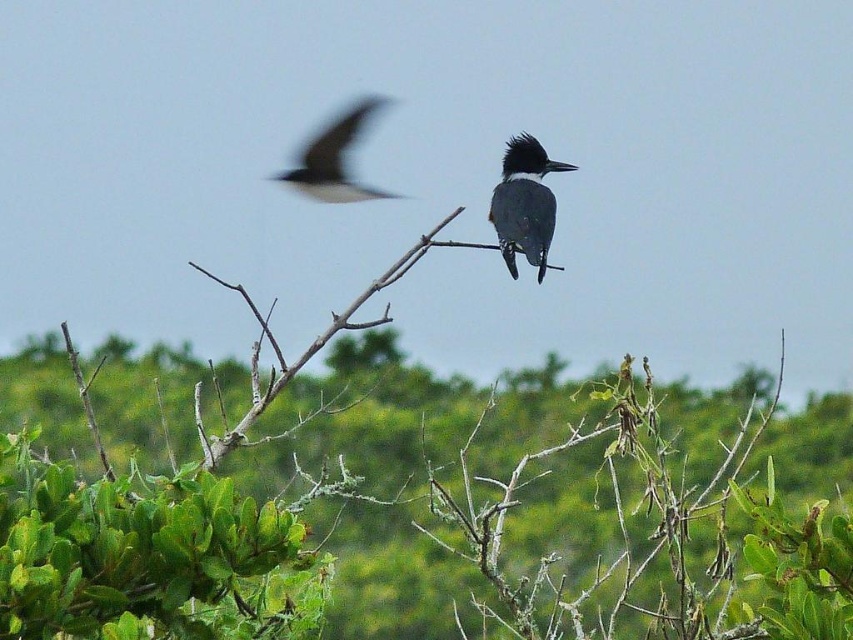
Question: Is green leafy tree at center in front of brown rough branch at center?

Choices:
 (A) no
 (B) yes

Answer: (B)

Question: Which point is farther to the camera?

Choices:
 (A) dark gray feathers at upper left
 (B) gray glossy bird at center

Answer: (A)

Question: Does green leafy tree at center come behind dark gray feathers at upper left?

Choices:
 (A) no
 (B) yes

Answer: (A)

Question: Among these points, which one is farthest from the camera?

Choices:
 (A) (514, 152)
 (B) (546, 580)
 (C) (329, 168)
 (D) (244, 298)

Answer: (C)

Question: Does brown rough branch at center have a greater width compared to dark gray feathers at upper left?

Choices:
 (A) no
 (B) yes

Answer: (B)

Question: Which of the following is the closest to the observer?

Choices:
 (A) green leafy tree at center
 (B) gray glossy bird at center
 (C) dark gray feathers at upper left

Answer: (A)